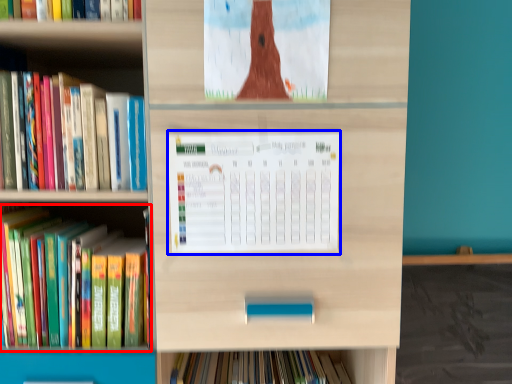
Question: Which object is closer to the camera taking this photo, book (highlighted by a red box) or paperback book (highlighted by a blue box)?

Choices:
 (A) book
 (B) paperback book

Answer: (B)